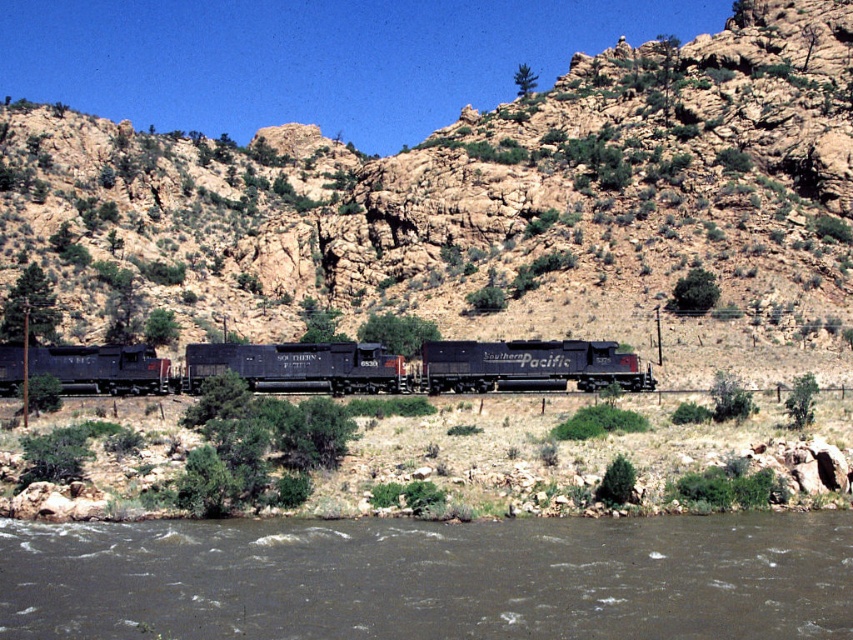
How distant is brown dirt at lower center from matte black locomotive at center?

brown dirt at lower center and matte black locomotive at center are 11.58 meters apart.

Which of these two, brown dirt at lower center or matte black locomotive at center, stands taller?

With more height is brown dirt at lower center.

Is point (132, 456) behind point (647, 368)?

No, it is in front of (647, 368).

The width and height of the screenshot is (853, 640). Find the location of `brown dirt at lower center`. brown dirt at lower center is located at coordinates (428, 460).

Who is more forward, (247, 595) or (33, 349)?

Point (247, 595)

Which is more to the left, brown muddy water at lower center or matte black locomotive at center?

Positioned to the left is matte black locomotive at center.

Which is in front, point (421, 577) or point (612, 355)?

Positioned in front is point (421, 577).

The height and width of the screenshot is (640, 853). Find the location of `brown muddy water at lower center`. brown muddy water at lower center is located at coordinates (431, 579).

Does brown muddy water at lower center have a greater height compared to brown dirt at lower center?

In fact, brown muddy water at lower center may be shorter than brown dirt at lower center.

Between point (650, 592) and point (68, 435), which one is positioned behind?

The point (68, 435) is behind.

Find the location of a particular element. The width and height of the screenshot is (853, 640). brown muddy water at lower center is located at coordinates (431, 579).